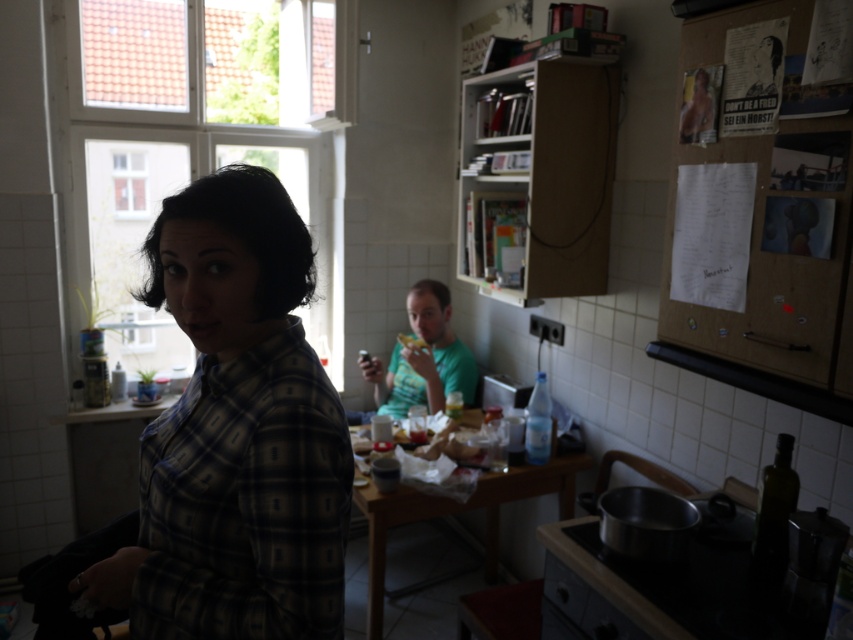
Is plaid shirt at center to the left of yellow matte sandwich at center from the viewer's perspective?

Correct, you'll find plaid shirt at center to the left of yellow matte sandwich at center.

Does point (262, 406) lie in front of point (404, 336)?

Yes, point (262, 406) is closer to viewer.

Where is `plaid shirt at center`? plaid shirt at center is located at coordinates (235, 433).

This screenshot has height=640, width=853. What do you see at coordinates (235, 433) in the screenshot? I see `plaid shirt at center` at bounding box center [235, 433].

Can you confirm if plaid shirt at center is wider than green matte shirt at center?

Incorrect, plaid shirt at center's width does not surpass green matte shirt at center's.

Who is more distant from viewer, (x=184, y=401) or (x=387, y=387)?

Positioned behind is point (x=387, y=387).

In order to click on plaid shirt at center in this screenshot , I will do `click(235, 433)`.

Can you confirm if green matte shirt at center is smaller than yellow matte sandwich at center?

Incorrect, green matte shirt at center is not smaller in size than yellow matte sandwich at center.

Where is `green matte shirt at center`? This screenshot has width=853, height=640. green matte shirt at center is located at coordinates (422, 356).